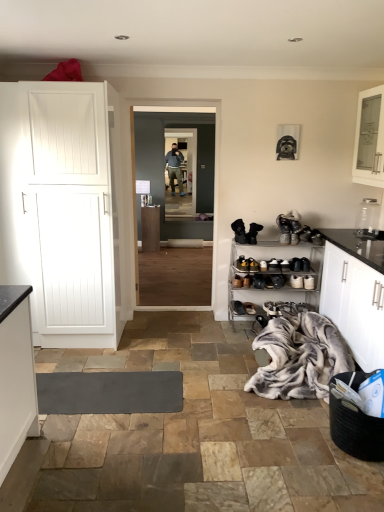
Question: Is brown suede shoe at lower center, the third footwear from the bottom, closer to camera compared to transparent glass jar at upper right?

Choices:
 (A) yes
 (B) no

Answer: (B)

Question: From the image's perspective, is brown suede shoe at lower center, the third footwear from the bottom, located beneath transparent glass jar at upper right?

Choices:
 (A) no
 (B) yes

Answer: (B)

Question: From the image's perspective, is brown suede shoe at lower center, the third footwear from the bottom, located above transparent glass jar at upper right?

Choices:
 (A) no
 (B) yes

Answer: (A)

Question: Could you tell me if brown suede shoe at lower center, the third footwear from the bottom, is turned towards transparent glass jar at upper right?

Choices:
 (A) no
 (B) yes

Answer: (A)

Question: Is brown suede shoe at lower center, the 3th footwear in the top-to-bottom sequence, positioned behind transparent glass jar at upper right?

Choices:
 (A) yes
 (B) no

Answer: (A)

Question: Would you consider brown suede shoe at lower center, the third footwear from the bottom, to be distant from transparent glass jar at upper right?

Choices:
 (A) no
 (B) yes

Answer: (B)

Question: From a real-world perspective, is transparent glass jar at upper right located higher than white matte cabinet at left?

Choices:
 (A) yes
 (B) no

Answer: (A)

Question: Is white matte cabinet at left a part of transparent glass jar at upper right?

Choices:
 (A) no
 (B) yes

Answer: (A)

Question: From the image's perspective, is transparent glass jar at upper right under white matte cabinet at left?

Choices:
 (A) no
 (B) yes

Answer: (A)

Question: Considering the relative sizes of transparent glass jar at upper right and white matte cabinet at left in the image provided, is transparent glass jar at upper right shorter than white matte cabinet at left?

Choices:
 (A) yes
 (B) no

Answer: (A)

Question: Does transparent glass jar at upper right have a smaller size compared to white matte cabinet at left?

Choices:
 (A) no
 (B) yes

Answer: (B)

Question: Can you confirm if transparent glass jar at upper right is positioned to the left of white matte cabinet at left?

Choices:
 (A) no
 (B) yes

Answer: (A)

Question: Does transparent glass door at center, the 1th glass door viewed from the front, appear on the left side of black leather shoe at lower center, placed as the 2th footwear when sorted from bottom to top?

Choices:
 (A) yes
 (B) no

Answer: (A)